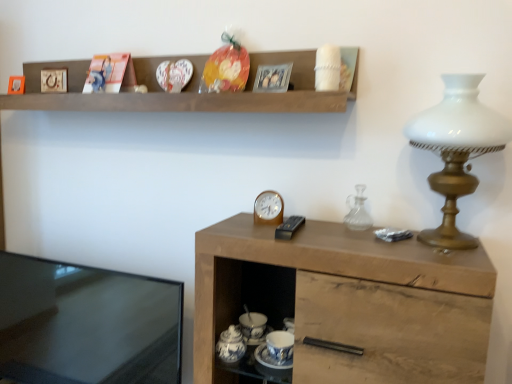
Question: From a real-world perspective, is wooden cabinet at right above or below wooden picture frame at upper left, positioned as the second picture frame in left-to-right order?

Choices:
 (A) below
 (B) above

Answer: (A)

Question: Considering the positions of point (337, 251) and point (48, 87), is point (337, 251) closer or farther from the camera than point (48, 87)?

Choices:
 (A) closer
 (B) farther

Answer: (A)

Question: Estimate the real-world distances between objects in this image. Which object is closer to the transparent glass carafe at right?

Choices:
 (A) wooden picture frame at upper left, the second picture frame when ordered from front to back
 (B) wooden cabinet at right
 (C) metallic silver clock at center
 (D) matte wooden picture frame at upper left, arranged as the third picture frame when viewed from the right
 (E) metallic silver picture frame at upper center, marked as the first picture frame in a right-to-left arrangement

Answer: (C)

Question: Estimate the real-world distances between objects in this image. Which object is farther from the metallic silver picture frame at upper center, the first picture frame positioned from the front?

Choices:
 (A) wooden picture frame at upper left, which ranks as the 2th picture frame in back-to-front order
 (B) matte wooden picture frame at upper left, marked as the first picture frame in a left-to-right arrangement
 (C) metallic silver clock at center
 (D) black glossy tv at left
 (E) white glass lamp at right

Answer: (D)